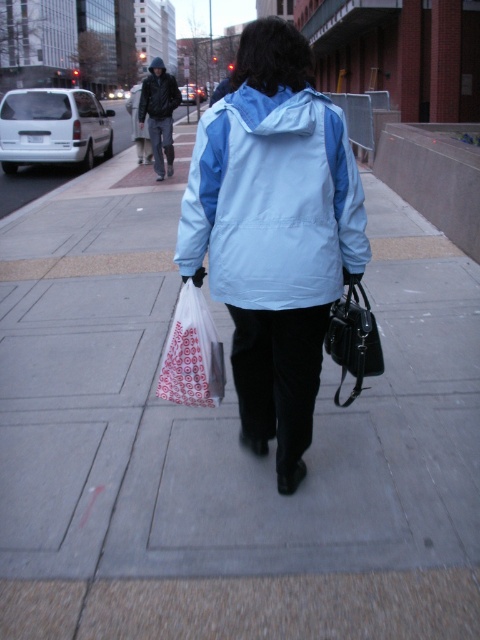
You are a photographer trying to capture the person in the image. The person is walking away from you. If you want to focus on the light blue fabric jacket at center without the black leather handbag at center blocking it, should you move forward or backward?

The light blue fabric jacket at center is in front of the black leather handbag at center. To avoid the handbag blocking the jacket, you should move backward to increase the distance between them, ensuring the jacket remains in focus without obstruction.

You are standing at the origin point of the image coordinate system. You see two points, point [269,90] and point [168,93]. Which point is closer to you?

Point [168,93] is closer to you because it is behind point [269,90].